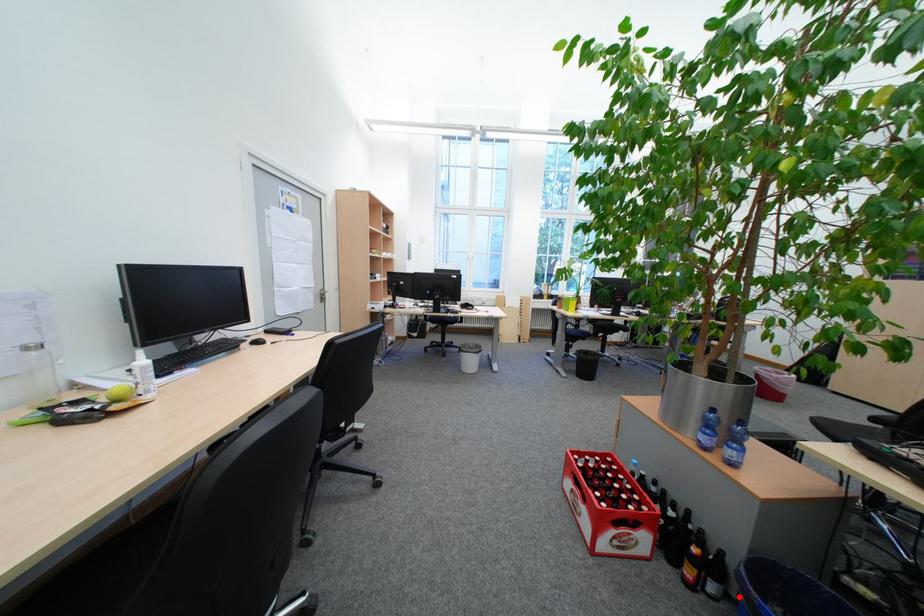
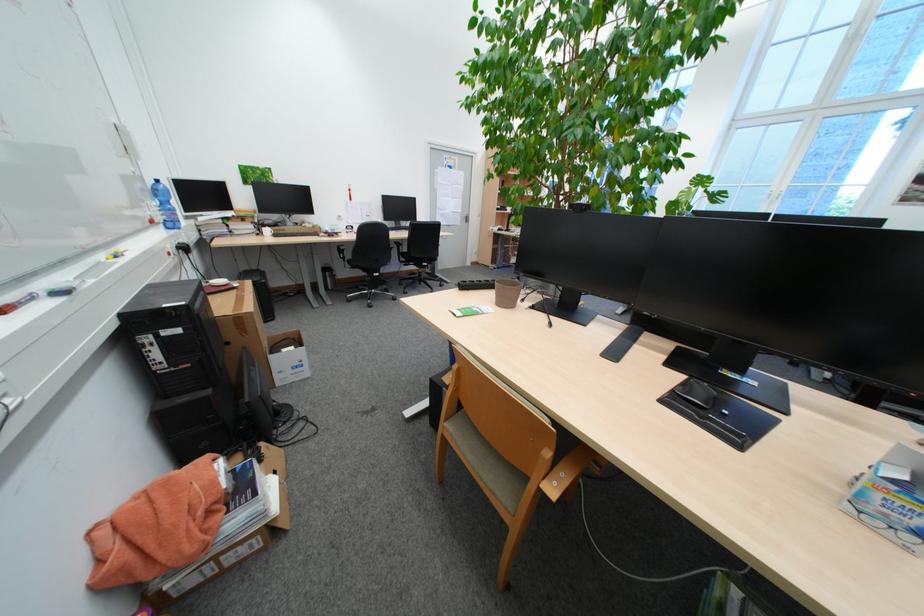
Question: I am providing you with two images of the same scene from different viewpoints. A red point is marked on the first image. Is the red point's position out of view in image 2?

Choices:
 (A) Yes
 (B) No

Answer: (A)